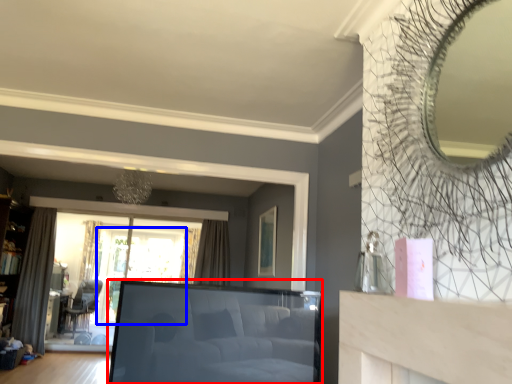
Question: Which point is closer to the camera, studio couch (highlighted by a red box) or window screen (highlighted by a blue box)?

Choices:
 (A) studio couch
 (B) window screen

Answer: (A)